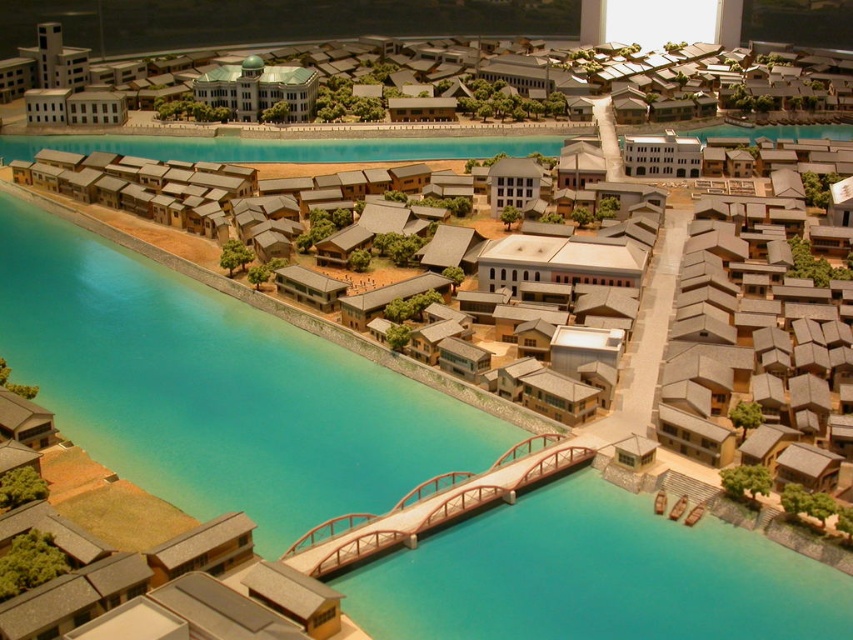
You are a visitor exploring the miniature town. You notice a point marked at coordinates (213,385). What is located at this point in the miniature town?

The point at coordinates (213,385) indicates transparent blue water at center.

You are a visitor standing at the edge of the miniature town facing the river. You notice the wooden bridge at center and the matte white building at center. Which object would appear larger to you?

The wooden bridge at center appears larger because it is closer to the viewer than the matte white building at center.